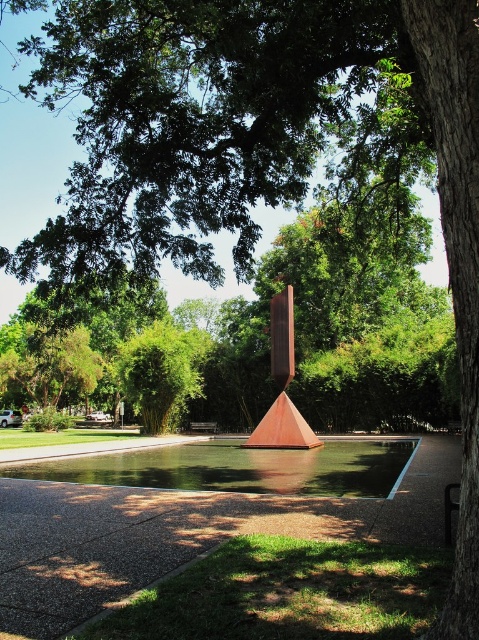
Does green bamboo at center appear on the left side of rusty metal sculpture at center?

Correct, you'll find green bamboo at center to the left of rusty metal sculpture at center.

How far apart are green bamboo at center and rusty metal sculpture at center?

→ They are 9.95 meters apart.

Between point (138, 362) and point (288, 404), which one is positioned in front?

Point (288, 404)

Identify the location of green bamboo at center. (161, 372).